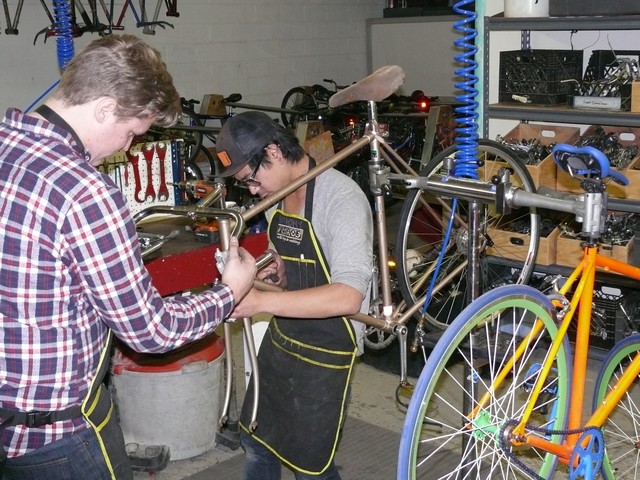
Locate an element on the screen. The height and width of the screenshot is (480, 640). floor is located at coordinates coord(370,444).